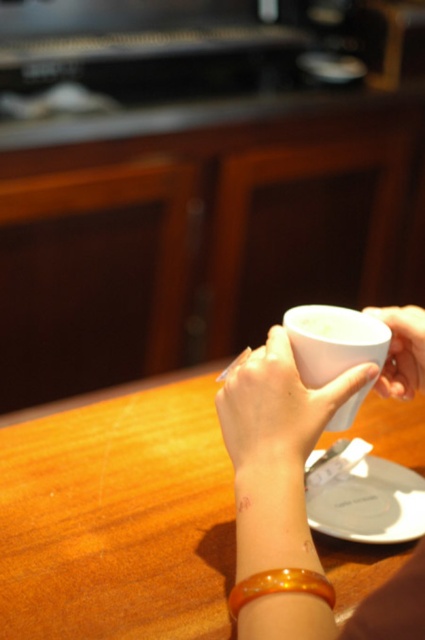
You are a delivery robot that needs to place a package on the table. The package is 21 inches long. There is a white cup at point [11,554] and a white plate beneath it. Can the package be placed between them without touching either?

The distance between the white cup at point [11,554] and the white plate beneath it is 21.60 inches. Since the package is 21 inches long, it can be placed between them without touching either as there is enough space.

You are a photographer setting up a shot of the hands holding a cup. The cup is at the center of the image. You need to place a small decorative item exactly at point (278, 406) to frame the cup better. What object is already present at that point?

The point (278, 406) indicates the white glossy cup at center, so placing an item there would cover the cup.

You are a photographer adjusting the camera focus. You need to focus on either the point at (218, 612) or the point at (388, 348). Which point should you choose if you want to focus on the object that is closer to the camera?

You should focus on point (218, 612) because it is closer to the viewer than point (388, 348).